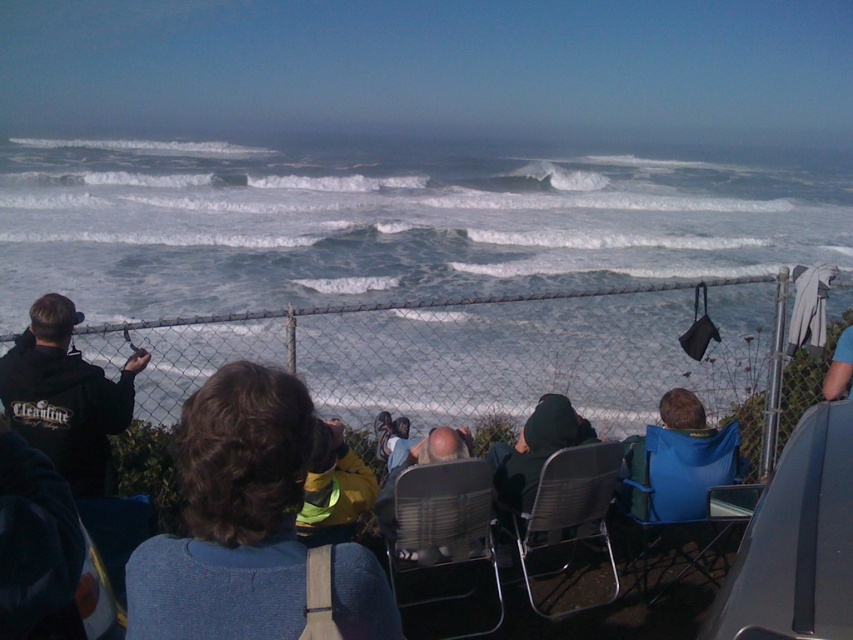
Does point (341, 428) come farther from viewer compared to point (848, 381)?

That is False.

Does point (331, 444) come in front of point (827, 381)?

Yes, point (331, 444) is in front of point (827, 381).

Locate an element on the screen. The image size is (853, 640). yellow fabric at center is located at coordinates (334, 488).

Between point (604, 524) and point (556, 448), which one is positioned in front?

Positioned in front is point (556, 448).

Can you confirm if black mesh chair at center is positioned to the left of dark green fabric jacket at center?

Incorrect, black mesh chair at center is not on the left side of dark green fabric jacket at center.

What are the coordinates of `black mesh chair at center` in the screenshot? It's located at (572, 506).

Locate an element on the screen. This screenshot has width=853, height=640. black mesh chair at center is located at coordinates (572, 506).

Is black matte jacket at left further to the viewer compared to black mesh chair at center?

No, it is in front of black mesh chair at center.

Is point (57, 320) closer to camera compared to point (595, 445)?

Yes, it is in front of point (595, 445).

The width and height of the screenshot is (853, 640). I want to click on black matte jacket at left, so click(67, 396).